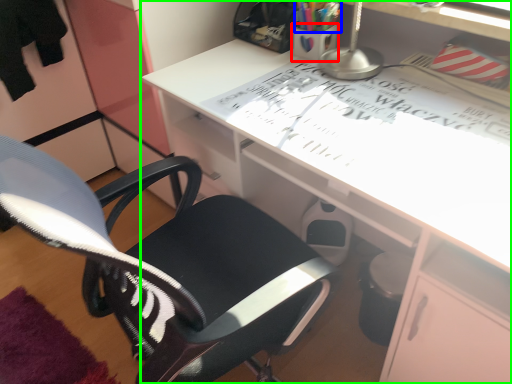
Question: Which object is the farthest from stationery (highlighted by a red box)? Choose among these: stationery (highlighted by a blue box) or desk (highlighted by a green box).

Choices:
 (A) stationery
 (B) desk

Answer: (B)